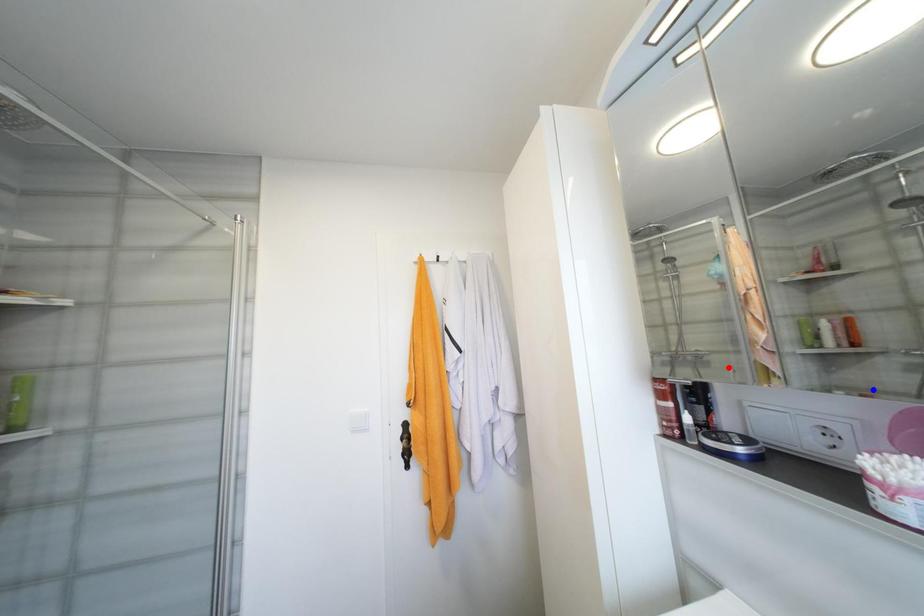
Question: Which of the two points in the image is closer to the camera?

Choices:
 (A) Blue point is closer.
 (B) Red point is closer.

Answer: (A)